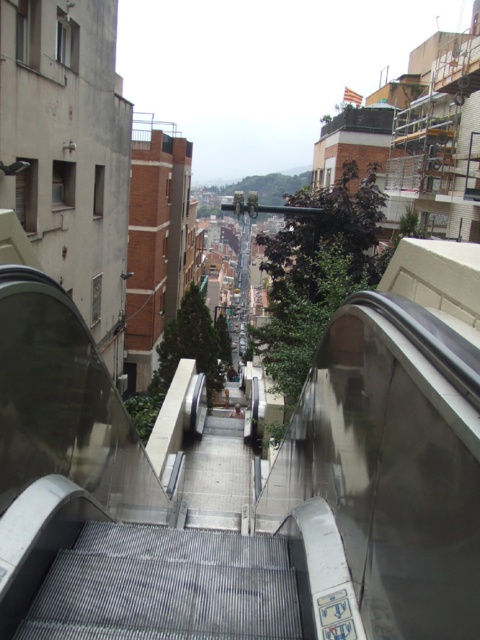
Question: Is metallic gray escalator at center bigger than metallic gray stairs at center?

Choices:
 (A) yes
 (B) no

Answer: (A)

Question: Does metallic gray escalator at center have a lesser width compared to metallic gray stairs at center?

Choices:
 (A) yes
 (B) no

Answer: (B)

Question: Which of the following is the closest to the observer?

Choices:
 (A) metallic gray stairs at center
 (B) metallic gray escalator at center

Answer: (B)

Question: Does metallic gray escalator at center have a lesser width compared to metallic gray stairs at center?

Choices:
 (A) no
 (B) yes

Answer: (A)